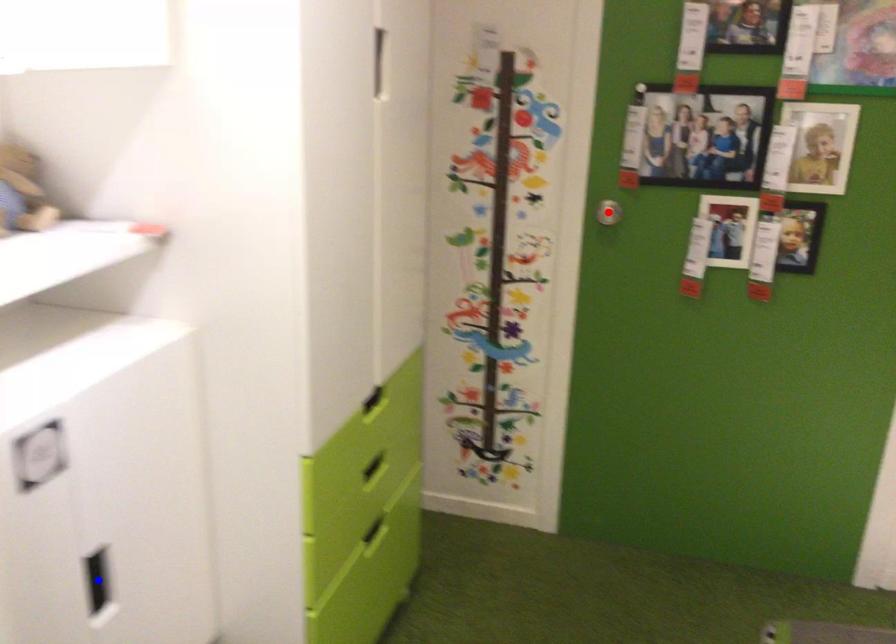
Question: Two points are marked on the image. Which point is closer to the camera?

Choices:
 (A) Blue point is closer.
 (B) Red point is closer.

Answer: (A)